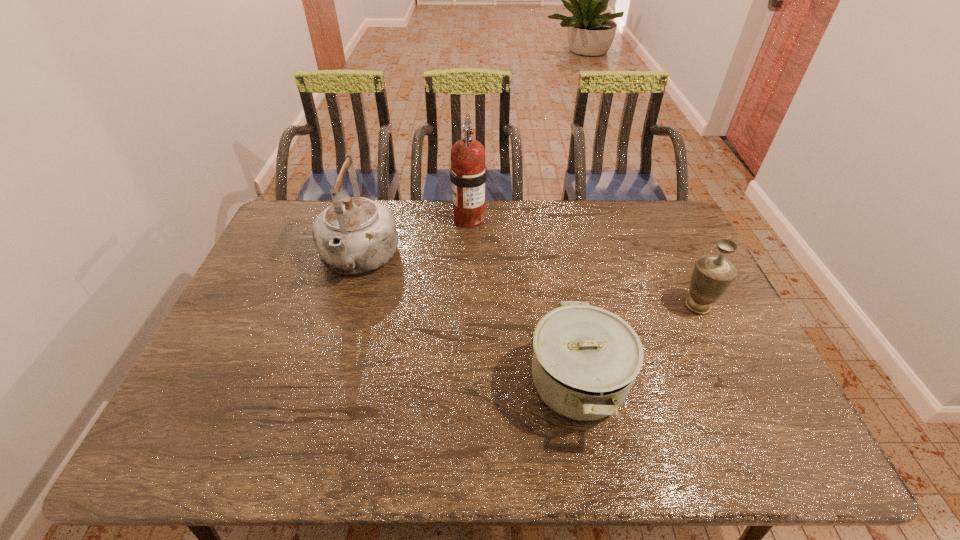
The width and height of the screenshot is (960, 540). Find the location of `fire extinguisher`. fire extinguisher is located at coordinates (468, 173).

This screenshot has height=540, width=960. In order to click on the tallest object in this screenshot , I will do `click(468, 173)`.

The image size is (960, 540). Find the location of `kettle`. kettle is located at coordinates (355, 235).

The height and width of the screenshot is (540, 960). In order to click on the third shortest object in this screenshot , I will do `click(355, 235)`.

The width and height of the screenshot is (960, 540). In order to click on the second shortest object in this screenshot , I will do `click(712, 275)`.

Where is `the rightmost object`? the rightmost object is located at coordinates (712, 275).

You are a GUI agent. You are given a task and a screenshot of the screen. Output one action in this format:
    pyautogui.click(x=<x>, y=<y>)
    Task: Click on the shortest object
    This screenshot has height=540, width=960.
    Given the screenshot: What is the action you would take?
    pyautogui.click(x=585, y=360)

Where is `saucepan`? This screenshot has width=960, height=540. saucepan is located at coordinates tap(585, 360).

You are a GUI agent. You are given a task and a screenshot of the screen. Output one action in this format:
    pyautogui.click(x=<x>, y=<y>)
    Task: Click on the free spot located at the nozzle of the fire extinguisher
    
    Given the screenshot: What is the action you would take?
    pyautogui.click(x=468, y=284)

At what (x,y) coordinates should I click in order to perform the action: click on vacant position located 0.110m at the spout of the leftmost object. Please return your answer as a coordinate pair (x, y). Looking at the image, I should click on (340, 323).